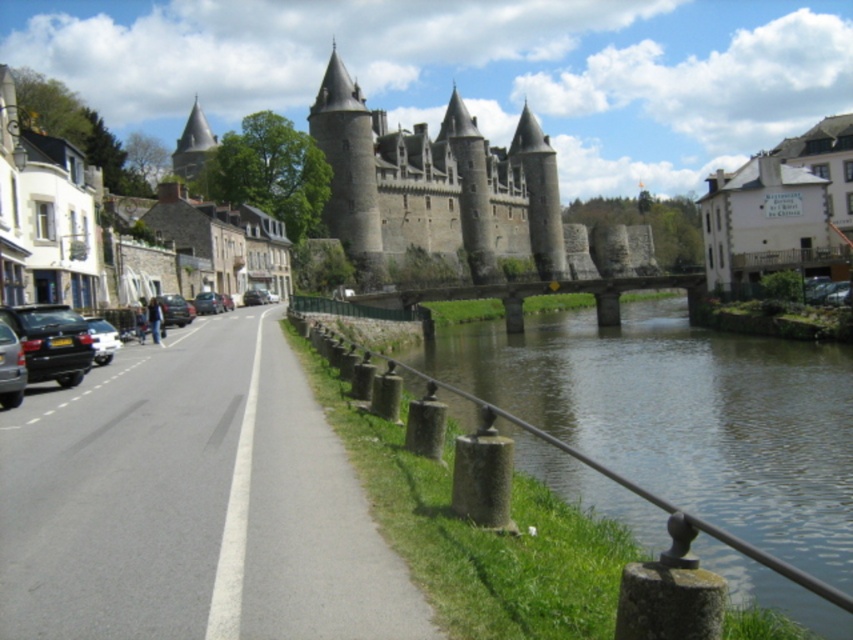
Question: Which is nearer to the green stone river at lower center?

Choices:
 (A) shiny black car at road center
 (B) gray stone castle at center
 (C) metallic silver car at road center
 (D) white painted building at upper right

Answer: (D)

Question: Estimate the real-world distances between objects in this image. Which object is farther from the gray stone castle at center?

Choices:
 (A) green stone river at lower center
 (B) silver metallic car at left
 (C) shiny black car at road center

Answer: (B)

Question: Which point is closer to the camera taking this photo?

Choices:
 (A) (24, 326)
 (B) (410, 179)
 (C) (109, 360)

Answer: (A)

Question: Can you confirm if green stone river at lower center is positioned above shiny black car at road center?

Choices:
 (A) no
 (B) yes

Answer: (A)

Question: Is shiny black car at road center above metallic silver car at road center?

Choices:
 (A) no
 (B) yes

Answer: (A)

Question: Considering the relative positions of gray stone castle at center and silver metallic car at left in the image provided, where is gray stone castle at center located with respect to silver metallic car at left?

Choices:
 (A) above
 (B) below

Answer: (A)